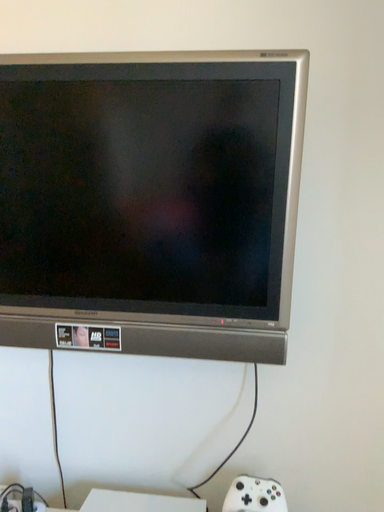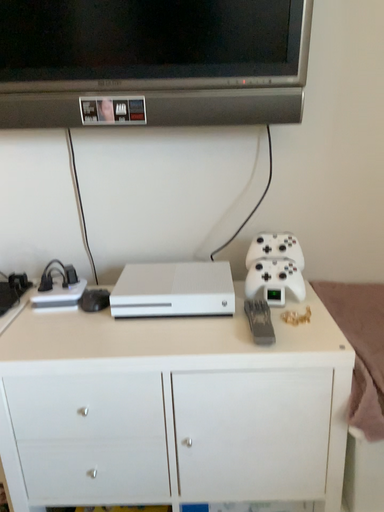
Question: Which way did the camera rotate in the video?

Choices:
 (A) rotated upward
 (B) rotated downward

Answer: (B)